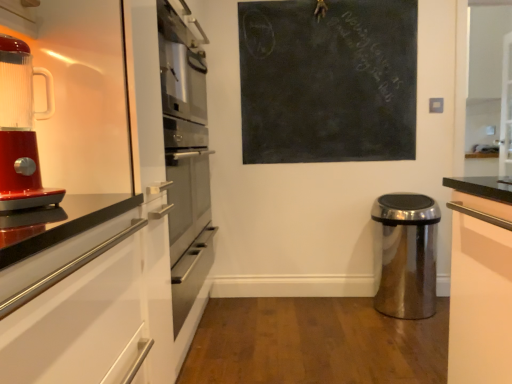
Where is `vacant space positioned to the left of polished stainless steel trash can at lower right`? This screenshot has height=384, width=512. vacant space positioned to the left of polished stainless steel trash can at lower right is located at coordinates (351, 316).